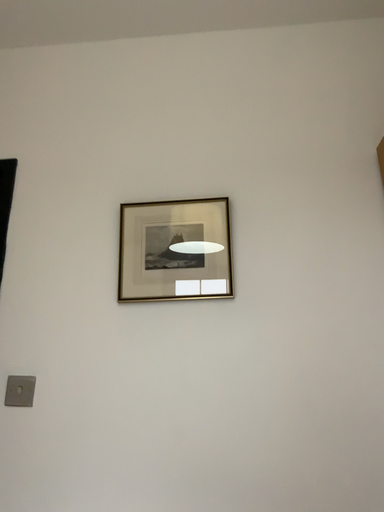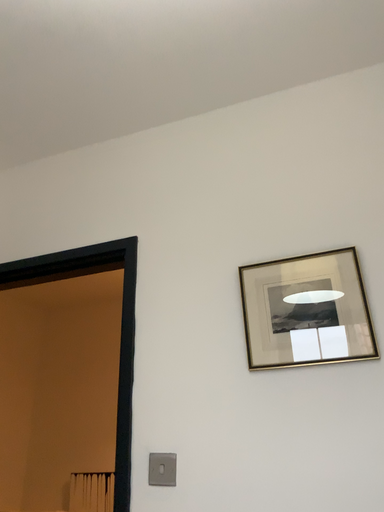
Question: Which way did the camera rotate in the video?

Choices:
 (A) rotated right
 (B) rotated left

Answer: (B)